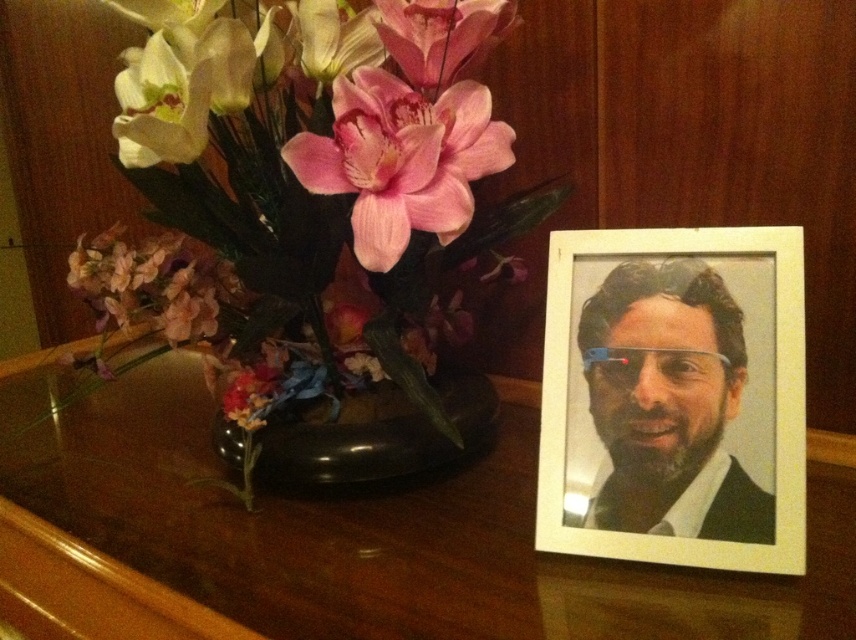
Question: Which point is closer to the camera taking this photo?

Choices:
 (A) (625, 492)
 (B) (431, 67)
 (C) (123, 266)
 (D) (327, 621)

Answer: (D)

Question: From the image, what is the correct spatial relationship of pink matte flower at center in relation to pink silky flower at upper center?

Choices:
 (A) left
 (B) right

Answer: (A)

Question: Which of the following is the closest to the observer?

Choices:
 (A) (128, 285)
 (B) (724, 404)
 (C) (441, 452)
 (D) (345, 220)

Answer: (B)

Question: Considering the relative positions of white wood picture frame at right and pink matte flower at left in the image provided, where is white wood picture frame at right located with respect to pink matte flower at left?

Choices:
 (A) left
 (B) right

Answer: (B)

Question: Is glossy wood table at center to the left of black glossy vase at left from the viewer's perspective?

Choices:
 (A) yes
 (B) no

Answer: (A)

Question: Which point is closer to the camera?

Choices:
 (A) (235, 449)
 (B) (560, 472)

Answer: (B)